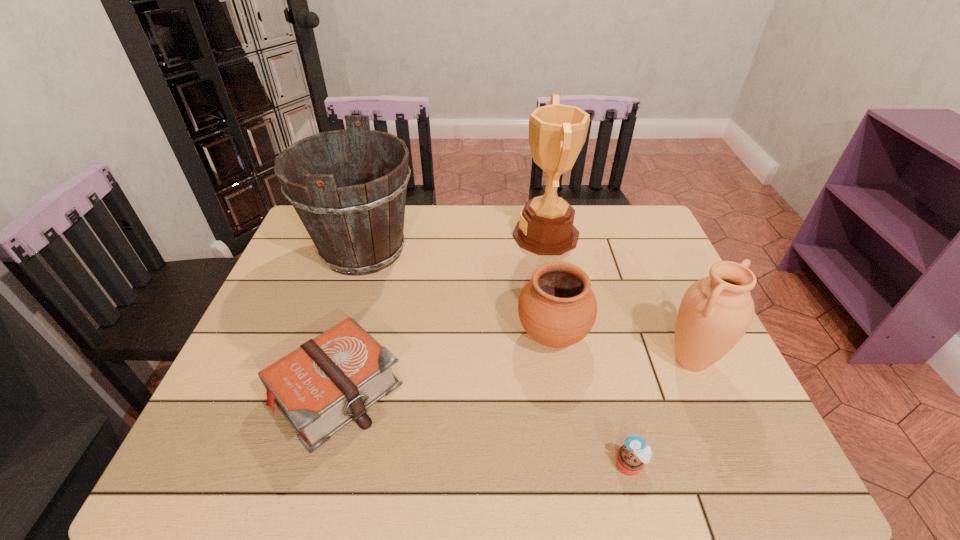
You are a GUI agent. You are given a task and a screenshot of the screen. Output one action in this format:
    pyautogui.click(x=<x>, y=<y>)
    Task: Click on the award
    The width and height of the screenshot is (960, 540).
    Given the screenshot: What is the action you would take?
    pyautogui.click(x=557, y=133)

I want to click on bucket, so click(x=357, y=224).

I want to click on the third tallest object, so click(x=716, y=311).

You are a GUI agent. You are given a task and a screenshot of the screen. Output one action in this format:
    pyautogui.click(x=<x>, y=<y>)
    Task: Click on the rightmost object
    
    Given the screenshot: What is the action you would take?
    pyautogui.click(x=716, y=311)

Where is `pottery`? pottery is located at coordinates (557, 308).

This screenshot has height=540, width=960. I want to click on Bible, so click(x=327, y=382).

Find the location of a particular element. muffin is located at coordinates (631, 457).

Where is `free location located on the front-facing side of the award`? This screenshot has width=960, height=540. free location located on the front-facing side of the award is located at coordinates point(427,235).

Locate an element on the screen. vacant space located 0.230m on the front-facing side of the award is located at coordinates (440, 235).

Identify the location of free space located on the front-facing side of the award. (427, 235).